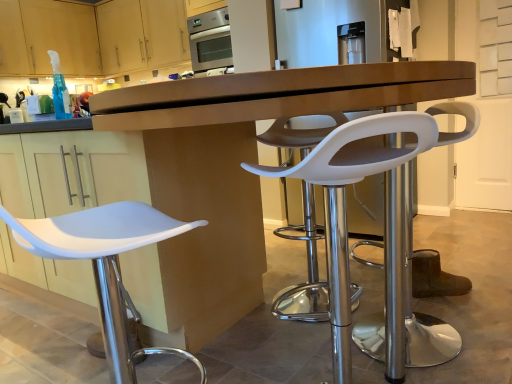
Question: Is matte wood cabinets at upper left, arranged as the 1th cabinetry when viewed from the right, completely or partially inside white plastic stool at center, arranged as the second chair when viewed from the left?

Choices:
 (A) yes
 (B) no

Answer: (B)

Question: Is white plastic stool at center, marked as the 2th chair in a right-to-left arrangement, outside of matte wood cabinets at upper left, placed as the 2th cabinetry when sorted from left to right?

Choices:
 (A) yes
 (B) no

Answer: (A)

Question: Can you see white plastic stool at center, marked as the 2th chair in a right-to-left arrangement, touching matte wood cabinets at upper left, placed as the 2th cabinetry when sorted from left to right?

Choices:
 (A) yes
 (B) no

Answer: (B)

Question: Is white plastic stool at center, marked as the 2th chair in a right-to-left arrangement, positioned with its back to matte wood cabinets at upper left, arranged as the 1th cabinetry when viewed from the right?

Choices:
 (A) no
 (B) yes

Answer: (A)

Question: From a real-world perspective, is white plastic stool at center, arranged as the second chair when viewed from the left, over matte wood cabinets at upper left, arranged as the 1th cabinetry when viewed from the right?

Choices:
 (A) no
 (B) yes

Answer: (A)

Question: From the image's perspective, is matte wood cabinets at upper left, arranged as the 1th cabinetry when viewed from the right, positioned above or below translucent blue plastic spray bottle at upper left?

Choices:
 (A) above
 (B) below

Answer: (A)

Question: In the image, is matte wood cabinets at upper left, arranged as the 1th cabinetry when viewed from the right, positioned in front of or behind translucent blue plastic spray bottle at upper left?

Choices:
 (A) behind
 (B) front

Answer: (A)

Question: Considering the positions of matte wood cabinets at upper left, arranged as the 1th cabinetry when viewed from the right, and translucent blue plastic spray bottle at upper left in the image, is matte wood cabinets at upper left, arranged as the 1th cabinetry when viewed from the right, wider or thinner than translucent blue plastic spray bottle at upper left?

Choices:
 (A) wide
 (B) thin

Answer: (A)

Question: Is matte wood cabinets at upper left, placed as the 2th cabinetry when sorted from left to right, taller or shorter than translucent blue plastic spray bottle at upper left?

Choices:
 (A) tall
 (B) short

Answer: (A)

Question: In terms of height, does white plastic stool at center, the first chair in the right-to-left sequence, look taller or shorter compared to matte brown desk at center?

Choices:
 (A) tall
 (B) short

Answer: (B)

Question: Relative to matte brown desk at center, is white plastic stool at center, the first chair in the right-to-left sequence, in front or behind?

Choices:
 (A) behind
 (B) front

Answer: (A)

Question: Considering the positions of white plastic stool at center, which is counted as the 3th chair, starting from the left, and matte brown desk at center in the image, is white plastic stool at center, which is counted as the 3th chair, starting from the left, wider or thinner than matte brown desk at center?

Choices:
 (A) wide
 (B) thin

Answer: (B)

Question: Is point (418, 344) closer or farther from the camera than point (352, 97)?

Choices:
 (A) closer
 (B) farther

Answer: (B)

Question: Is translucent blue plastic spray bottle at upper left wider or thinner than white plastic stool at center, the first chair in the right-to-left sequence?

Choices:
 (A) thin
 (B) wide

Answer: (A)

Question: Do you think translucent blue plastic spray bottle at upper left is within white plastic stool at center, which is counted as the 3th chair, starting from the left, or outside of it?

Choices:
 (A) outside
 (B) inside

Answer: (A)